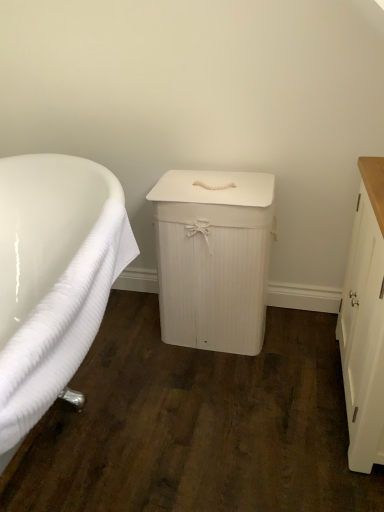
Question: Considering the relative sizes of white wood laundry bin at center, which is the 2th cabinetry from right to left, and white ribbed towel at left in the image provided, is white wood laundry bin at center, which is the 2th cabinetry from right to left, thinner than white ribbed towel at left?

Choices:
 (A) no
 (B) yes

Answer: (B)

Question: Does white wood laundry bin at center, which is the 2th cabinetry from right to left, have a smaller size compared to white ribbed towel at left?

Choices:
 (A) yes
 (B) no

Answer: (A)

Question: From the image's perspective, would you say white wood laundry bin at center, which ranks as the 1th cabinetry in left-to-right order, is positioned over white ribbed towel at left?

Choices:
 (A) yes
 (B) no

Answer: (A)

Question: Is white wood laundry bin at center, which is the 2th cabinetry from right to left, next to white ribbed towel at left?

Choices:
 (A) yes
 (B) no

Answer: (B)

Question: From a real-world perspective, is white wood laundry bin at center, which ranks as the 1th cabinetry in left-to-right order, positioned over white ribbed towel at left based on gravity?

Choices:
 (A) no
 (B) yes

Answer: (A)

Question: Choose the correct answer: Is white wood cabinet at right, marked as the 2th cabinetry in a left-to-right arrangement, inside white wood laundry bin at center, which is the 2th cabinetry from right to left, or outside it?

Choices:
 (A) outside
 (B) inside

Answer: (A)

Question: In terms of height, does white wood cabinet at right, marked as the 2th cabinetry in a left-to-right arrangement, look taller or shorter compared to white wood laundry bin at center, which is the 2th cabinetry from right to left?

Choices:
 (A) short
 (B) tall

Answer: (B)

Question: Is white wood cabinet at right, which is the first cabinetry in right-to-left order, to the left or to the right of white wood laundry bin at center, which ranks as the 1th cabinetry in left-to-right order, in the image?

Choices:
 (A) right
 (B) left

Answer: (A)

Question: Relative to white wood laundry bin at center, which ranks as the 1th cabinetry in left-to-right order, is white wood cabinet at right, which is the first cabinetry in right-to-left order, in front or behind?

Choices:
 (A) front
 (B) behind

Answer: (A)

Question: In the image, is white wood cabinet at right, marked as the 2th cabinetry in a left-to-right arrangement, on the left side or the right side of white ribbed towel at left?

Choices:
 (A) left
 (B) right

Answer: (B)

Question: Considering the positions of white wood cabinet at right, which is the first cabinetry in right-to-left order, and white ribbed towel at left in the image, is white wood cabinet at right, which is the first cabinetry in right-to-left order, taller or shorter than white ribbed towel at left?

Choices:
 (A) tall
 (B) short

Answer: (B)

Question: Choose the correct answer: Is white wood cabinet at right, marked as the 2th cabinetry in a left-to-right arrangement, inside white ribbed towel at left or outside it?

Choices:
 (A) inside
 (B) outside

Answer: (B)

Question: Based on their sizes in the image, would you say white wood cabinet at right, which is the first cabinetry in right-to-left order, is bigger or smaller than white ribbed towel at left?

Choices:
 (A) big
 (B) small

Answer: (B)

Question: Is point (114, 242) positioned closer to the camera than point (365, 223)?

Choices:
 (A) farther
 (B) closer

Answer: (B)

Question: Do you think white ribbed towel at left is within white wood cabinet at right, which is the first cabinetry in right-to-left order, or outside of it?

Choices:
 (A) outside
 (B) inside

Answer: (A)